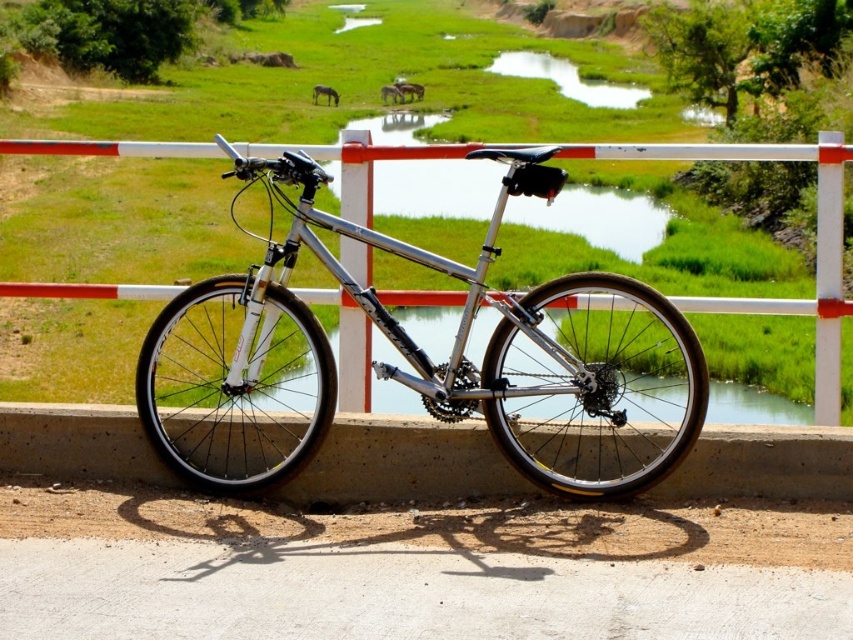
Does silver metallic mountain bike at center have a lesser width compared to silver metallic bicycle at center?

Yes, silver metallic mountain bike at center is thinner than silver metallic bicycle at center.

Does silver metallic mountain bike at center have a smaller size compared to silver metallic bicycle at center?

Correct, silver metallic mountain bike at center occupies less space than silver metallic bicycle at center.

Is point (554, 392) positioned in front of point (828, 230)?

Yes, point (554, 392) is in front of point (828, 230).

Identify the location of silver metallic mountain bike at center. The image size is (853, 640). (418, 358).